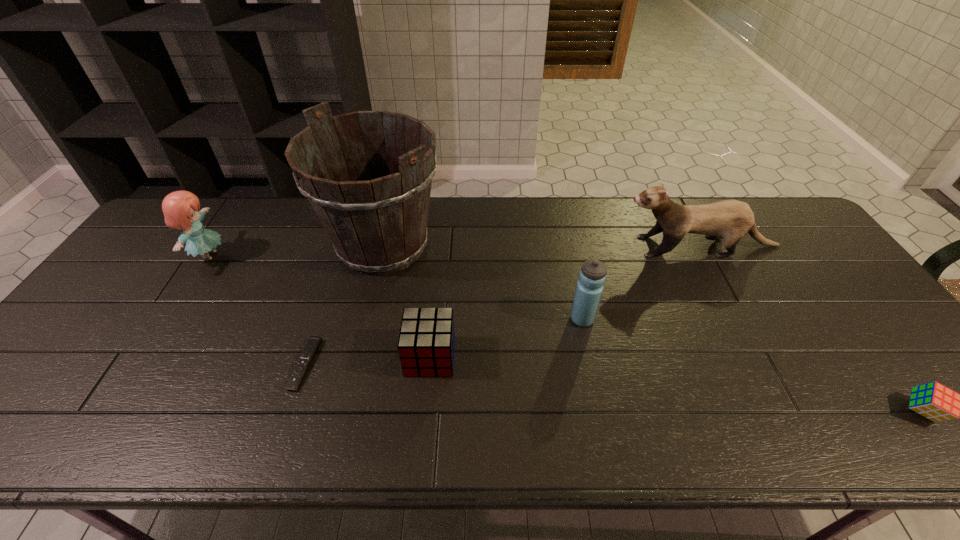
The image size is (960, 540). Identify the location of free location at the far right corner of the desktop. (756, 222).

The height and width of the screenshot is (540, 960). What are the coordinates of `vacant space that is in between the second object from right to left and the taller cube` in the screenshot? It's located at (564, 301).

The width and height of the screenshot is (960, 540). Find the location of `vacant area that lies between the water bottle and the farther cube`. vacant area that lies between the water bottle and the farther cube is located at coordinates (506, 338).

Where is `empty location between the shortest object and the doll`? empty location between the shortest object and the doll is located at coordinates (257, 310).

Where is `free spot between the remote control and the doll`? free spot between the remote control and the doll is located at coordinates (257, 310).

Image resolution: width=960 pixels, height=540 pixels. Identify the location of free space that is in between the shortest object and the second object from right to left. (502, 305).

What are the coordinates of `vacant area that lies between the ferret and the shortest object` in the screenshot? It's located at (502, 305).

Where is `unoccupied area between the shorter cube and the shortest object`? The height and width of the screenshot is (540, 960). unoccupied area between the shorter cube and the shortest object is located at coordinates (613, 388).

I want to click on free space between the sixth object from left to right and the rightmost object, so click(811, 328).

You are a GUI agent. You are given a task and a screenshot of the screen. Output one action in this format:
    pyautogui.click(x=<x>, y=<y>)
    Task: Click on the vacant point located between the leftmost object and the farther cube
    
    Given the screenshot: What is the action you would take?
    pyautogui.click(x=320, y=306)